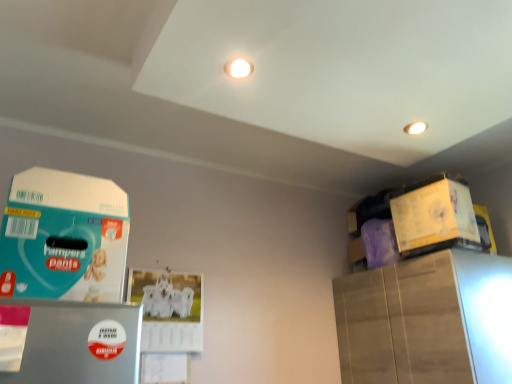
Question: Considering the relative sizes of yellow cardboard box at upper right, positioned as the first box in back-to-front order, and teal matte paper at left, which is counted as the second box, starting from the right, in the image provided, is yellow cardboard box at upper right, positioned as the first box in back-to-front order, shorter than teal matte paper at left, which is counted as the second box, starting from the right,?

Choices:
 (A) yes
 (B) no

Answer: (A)

Question: Is yellow cardboard box at upper right, which is the second box from left to right, not inside teal matte paper at left, which is counted as the second box, starting from the right?

Choices:
 (A) yes
 (B) no

Answer: (A)

Question: From a real-world perspective, is yellow cardboard box at upper right, which is counted as the 1th box, starting from the right, positioned over teal matte paper at left, marked as the first box in a front-to-back arrangement, based on gravity?

Choices:
 (A) no
 (B) yes

Answer: (B)

Question: Is yellow cardboard box at upper right, which is counted as the 1th box, starting from the right, far from teal matte paper at left, marked as the first box in a front-to-back arrangement?

Choices:
 (A) yes
 (B) no

Answer: (A)

Question: From a real-world perspective, is yellow cardboard box at upper right, which is the second box from left to right, beneath teal matte paper at left, marked as the first box in a front-to-back arrangement?

Choices:
 (A) yes
 (B) no

Answer: (B)

Question: Does yellow cardboard box at upper right, positioned as the first box in back-to-front order, have a larger size compared to teal matte paper at left, which ranks as the 2th box in back-to-front order?

Choices:
 (A) no
 (B) yes

Answer: (A)

Question: From a real-world perspective, is teal matte paper at left, marked as the first box in a front-to-back arrangement, located higher than yellow cardboard box at upper right, which is counted as the 1th box, starting from the right?

Choices:
 (A) yes
 (B) no

Answer: (B)

Question: Is teal matte paper at left, which ranks as the 2th box in back-to-front order, directly adjacent to yellow cardboard box at upper right, positioned as the first box in back-to-front order?

Choices:
 (A) no
 (B) yes

Answer: (A)

Question: From the image's perspective, would you say teal matte paper at left, the 1th box from the left, is shown under yellow cardboard box at upper right, positioned as the first box in back-to-front order?

Choices:
 (A) no
 (B) yes

Answer: (B)

Question: Is teal matte paper at left, marked as the first box in a front-to-back arrangement, to the right of yellow cardboard box at upper right, which is counted as the 1th box, starting from the right, from the viewer's perspective?

Choices:
 (A) no
 (B) yes

Answer: (A)

Question: Is teal matte paper at left, marked as the first box in a front-to-back arrangement, oriented away from yellow cardboard box at upper right, which appears as the 2th box when viewed from the front?

Choices:
 (A) no
 (B) yes

Answer: (A)

Question: Considering the relative sizes of teal matte paper at left, the 1th box from the left, and yellow cardboard box at upper right, which is the second box from left to right, in the image provided, is teal matte paper at left, the 1th box from the left, taller than yellow cardboard box at upper right, which is the second box from left to right,?

Choices:
 (A) no
 (B) yes

Answer: (B)

Question: From the image's perspective, is yellow cardboard box at upper right, which is the second box from left to right, positioned above or below teal matte paper at left, marked as the first box in a front-to-back arrangement?

Choices:
 (A) above
 (B) below

Answer: (A)